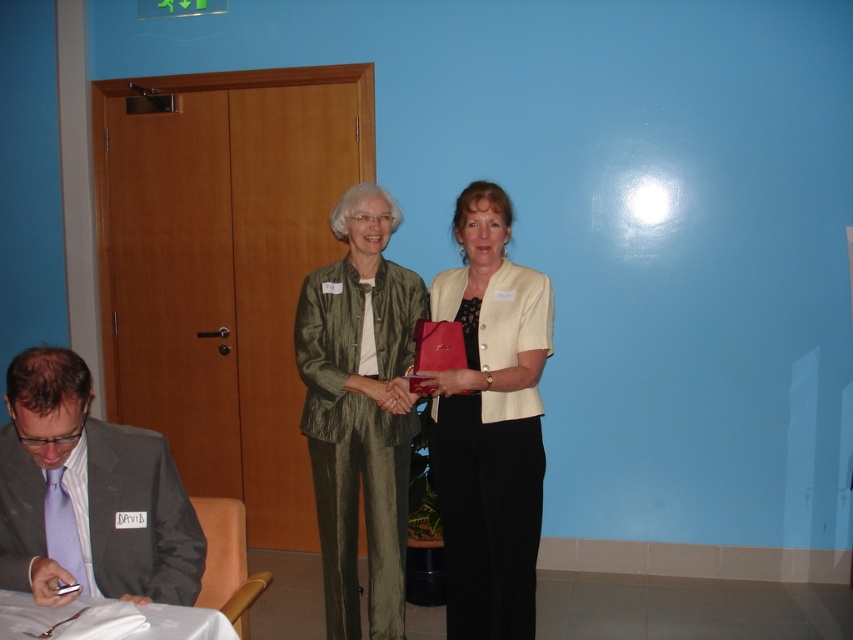
Which is behind, point (477, 460) or point (28, 502)?

The point (477, 460) is behind.

The height and width of the screenshot is (640, 853). Identify the location of matte cream blazer at center. (490, 422).

Who is taller, matte cream blazer at center or white cloth at lower left?

Standing taller between the two is matte cream blazer at center.

Does matte cream blazer at center have a greater width compared to white cloth at lower left?

Incorrect, matte cream blazer at center's width does not surpass white cloth at lower left's.

Is point (535, 276) positioned before point (202, 621)?

No, it is not.

At what (x,y) coordinates should I click in order to perform the action: click on matte cream blazer at center. Please return your answer as a coordinate pair (x, y). Looking at the image, I should click on (490, 422).

Does green textured suit at center have a greater width compared to white cloth at lower left?

No.

Does green textured suit at center have a lesser height compared to white cloth at lower left?

No, green textured suit at center is not shorter than white cloth at lower left.

Is point (357, 337) farther from camera compared to point (39, 618)?

Yes.

Where is `green textured suit at center`? green textured suit at center is located at coordinates (358, 410).